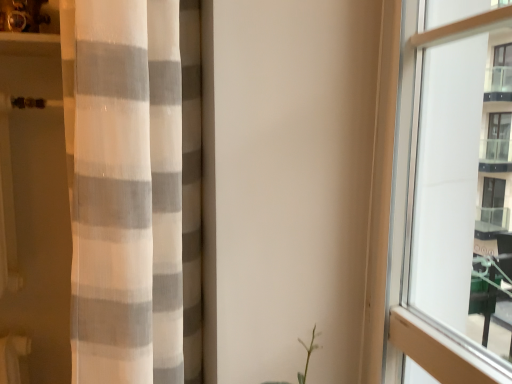
The image size is (512, 384). What are the coordinates of `white sheer fabric at left` in the screenshot? It's located at (124, 188).

Describe the element at coordinates (124, 188) in the screenshot. I see `white sheer fabric at left` at that location.

Identify the location of white sheer fabric at left. The height and width of the screenshot is (384, 512). (124, 188).